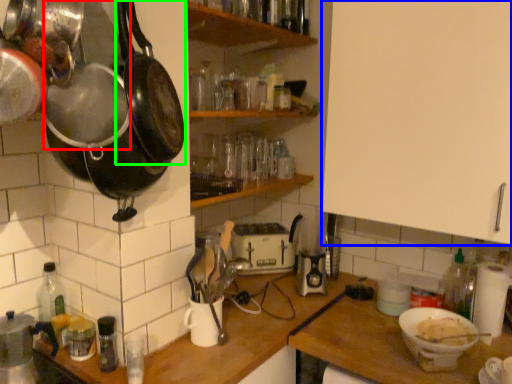
Question: Based on their relative distances, which object is nearer to frying pan (highlighted by a red box)? Choose from cabinetry (highlighted by a blue box) and frying pan (highlighted by a green box).

Choices:
 (A) cabinetry
 (B) frying pan

Answer: (B)